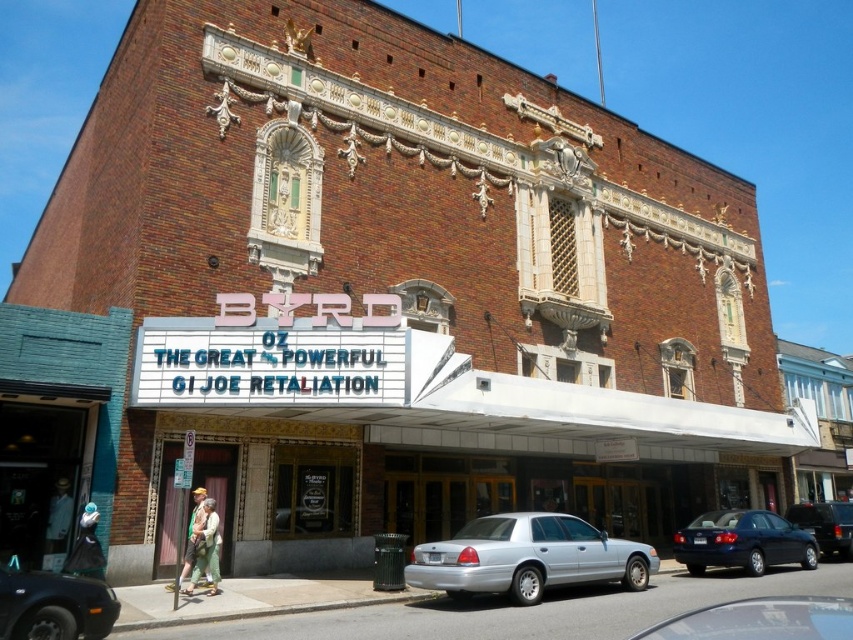
You are standing in front of the BYRD theater and want to park your car. The theater has a parking lot with a designated spot marked by a point at coordinates (54, 605). Can you determine the color and type of vehicle that can fit in this spot based on the information provided?

The point at coordinates (54, 605) indicates a black rubber car at lower left. Therefore, the parking spot is suitable for a car of similar size and type, specifically a black rubber car.

You are standing at the camera position and want to take a photo of the black rubber car at lower left. Is the car within the 100 feet range of your camera lens?

The black rubber car at lower left and camera are 73.35 feet apart from each other, so yes, the car is within the 100 feet range of your camera lens.